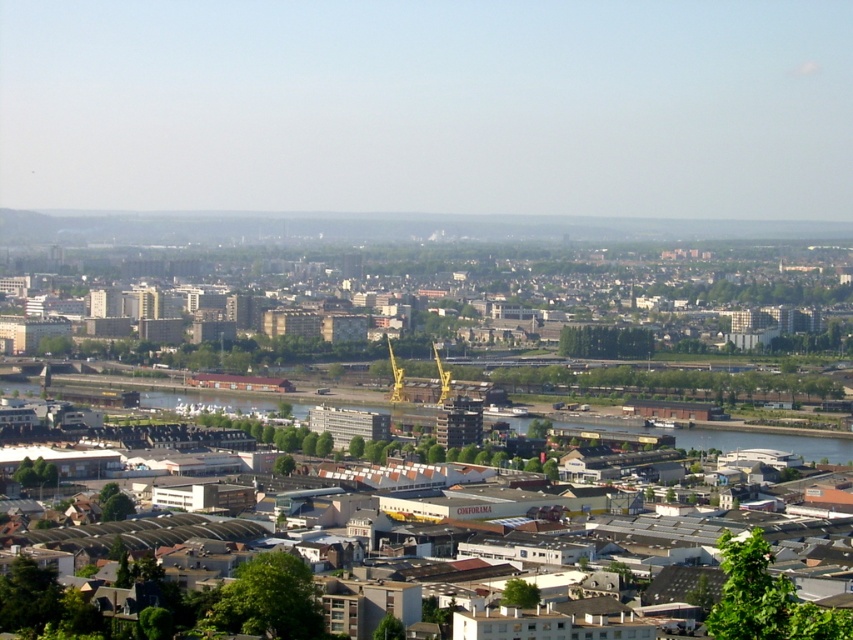
Is point (817, 336) more distant than point (428, 280)?

Yes.

Between point (821, 288) and point (636, 305), which one is positioned behind?

The point (821, 288) is more distant.

Is point (793, 392) less distant than point (720, 259)?

No, (793, 392) is further to viewer.

The height and width of the screenshot is (640, 853). Identify the location of gray concrete buildings at center. (631, 324).

Who is more distant from viewer, [848,452] or [695,442]?

The point [848,452] is behind.

Is gray concrete buildings at center positioned in front of green concrete waterway at lower center?

Yes, it is in front of green concrete waterway at lower center.

Between point (838, 328) and point (728, 445), which one is positioned behind?

The point (838, 328) is more distant.

Where is `gray concrete buildings at center`? This screenshot has width=853, height=640. gray concrete buildings at center is located at coordinates (631, 324).

Who is more distant from viewer, (370, 256) or (811, 456)?

Positioned behind is point (811, 456).

Is brown brick buildings at center above green concrete waterway at lower center?

Yes, brown brick buildings at center is above green concrete waterway at lower center.

Measure the distance between point (805, 308) and camera.

2209.87 feet

This screenshot has height=640, width=853. Identify the location of brown brick buildings at center. (486, 282).